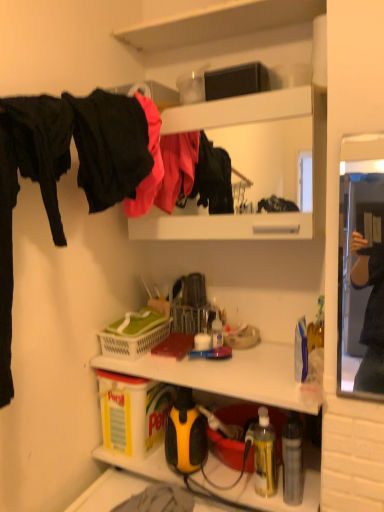
Question: Is black matte box at upper center, the 1th box positioned from the right, inside or outside of translucent yellow bottle at lower right, marked as the first bottle in a left-to-right arrangement?

Choices:
 (A) inside
 (B) outside

Answer: (B)

Question: From their relative heights in the image, would you say black matte box at upper center, which ranks as the 2th box in bottom-to-top order, is taller or shorter than translucent yellow bottle at lower right, marked as the first bottle in a left-to-right arrangement?

Choices:
 (A) short
 (B) tall

Answer: (A)

Question: Estimate the real-world distances between objects in this image. Which object is closer to the matte black jacket at upper center, which ranks as the 2th clothing in front-to-back order?

Choices:
 (A) translucent yellow bottle at lower right, marked as the first bottle in a left-to-right arrangement
 (B) yellow plastic box at lower left, placed as the first box when sorted from bottom to top
 (C) metallic silver bottle at lower right, the first bottle in the right-to-left sequence
 (D) white matte cabinet at upper center
 (E) yellow/black plastic sprayer at lower center

Answer: (E)

Question: Considering the real-world distances, which object is farthest from the black matte fabric at left, the second clothing in the back-to-front sequence?

Choices:
 (A) translucent yellow bottle at lower right, which is the 2th bottle in right-to-left order
 (B) white matte cabinet at upper center
 (C) white plastic picnic basket at center
 (D) yellow/black plastic sprayer at lower center
 (E) yellow plastic box at lower left, placed as the first box when sorted from left to right

Answer: (B)